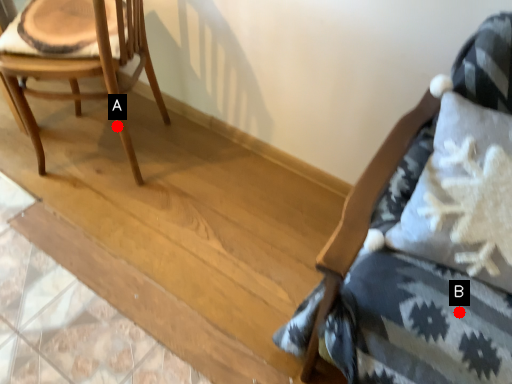
Question: Two points are circled on the image, labeled by A and B beside each circle. Among these points, which one is nearest to the camera?

Choices:
 (A) A is closer
 (B) B is closer

Answer: (B)